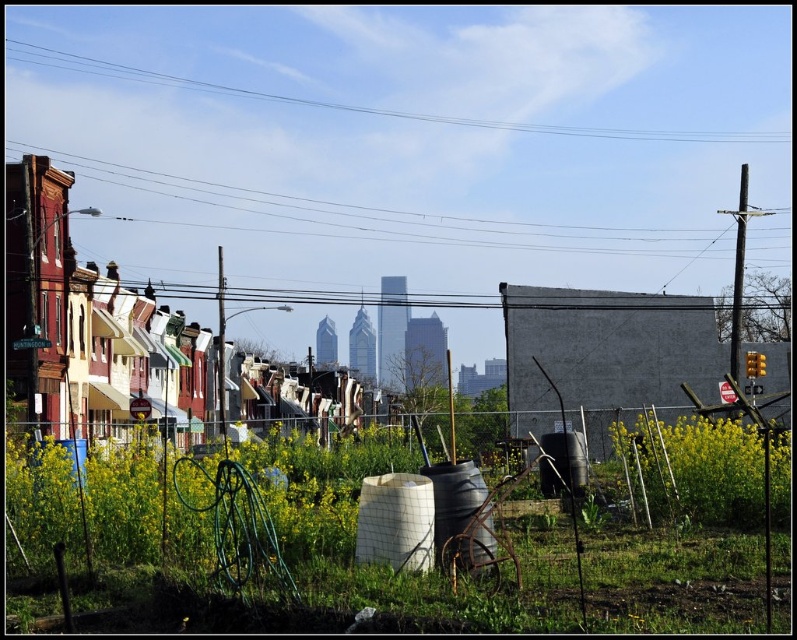
Which of these two, green grass at lower center or clear blue wire at upper center, stands shorter?

With less height is green grass at lower center.

Who is lower down, green grass at lower center or clear blue wire at upper center?

green grass at lower center

What do you see at coordinates (275, 538) in the screenshot? I see `green grass at lower center` at bounding box center [275, 538].

Locate an element on the screen. The width and height of the screenshot is (797, 640). green grass at lower center is located at coordinates (275, 538).